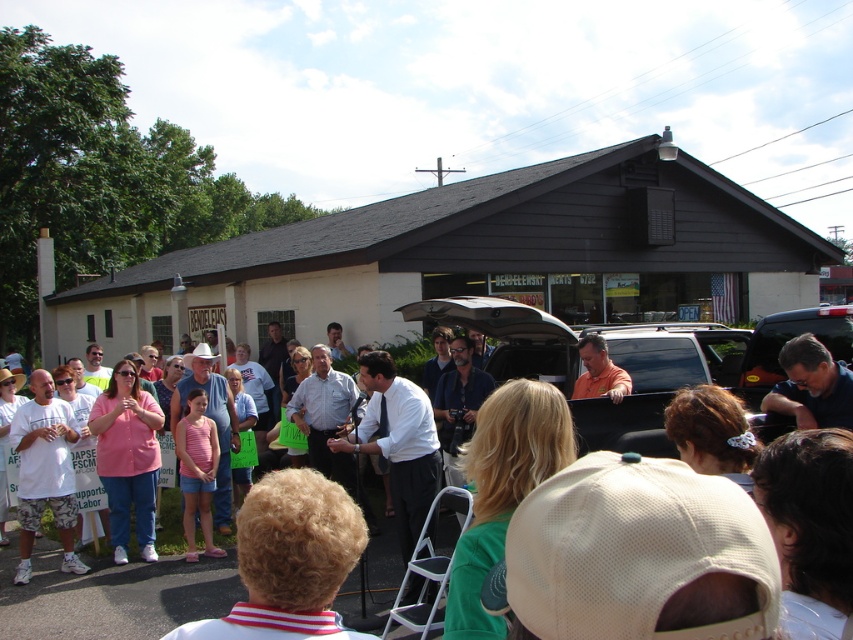
Does point (117, 547) come behind point (59, 454)?

Yes, it is behind point (59, 454).

Is pink fabric shirt at center to the right of white cotton shirt at lower left from the viewer's perspective?

Correct, you'll find pink fabric shirt at center to the right of white cotton shirt at lower left.

Is point (138, 388) more distant than point (30, 404)?

Yes, point (138, 388) is behind point (30, 404).

I want to click on pink fabric shirt at center, so click(126, 458).

Between brown hair at lower right and matte black shirt at center, which one has less height?

Standing shorter between the two is brown hair at lower right.

Which is more to the right, brown hair at lower right or matte black shirt at center?

From the viewer's perspective, matte black shirt at center appears more on the right side.

Is point (843, 472) more distant than point (811, 339)?

No, (843, 472) is in front of (811, 339).

In order to click on brown hair at lower right in this screenshot , I will do `click(809, 525)`.

Can you confirm if brown hair at lower right is wider than white cotton shirt at lower left?

Incorrect, brown hair at lower right's width does not surpass white cotton shirt at lower left's.

Image resolution: width=853 pixels, height=640 pixels. In order to click on brown hair at lower right in this screenshot , I will do coord(809,525).

Is point (845, 557) in front of point (61, 477)?

Yes, point (845, 557) is closer to viewer.

Locate an element on the screen. The width and height of the screenshot is (853, 640). brown hair at lower right is located at coordinates (809, 525).